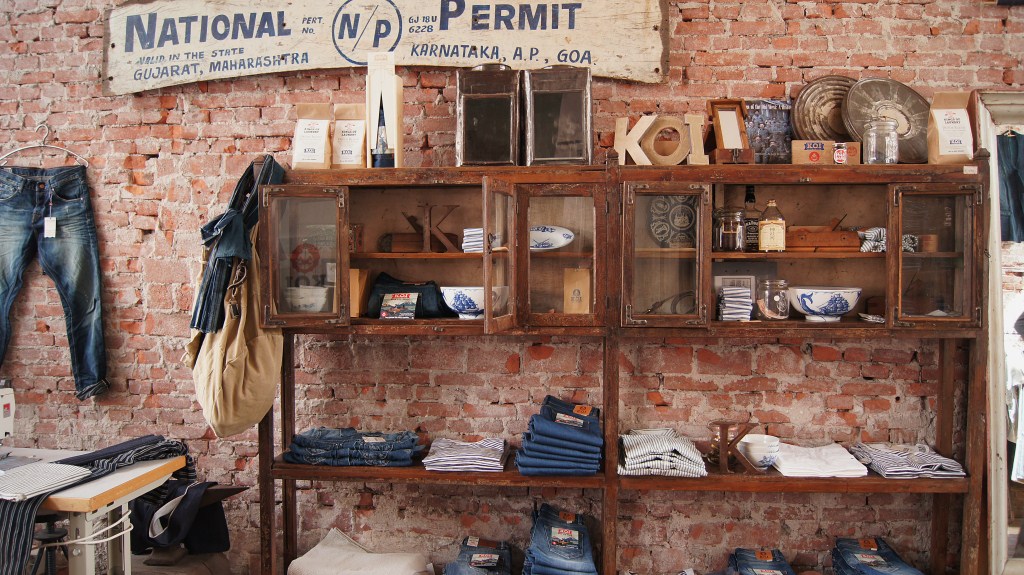
The height and width of the screenshot is (575, 1024). Identify the location of shelf. (810, 482), (454, 480).